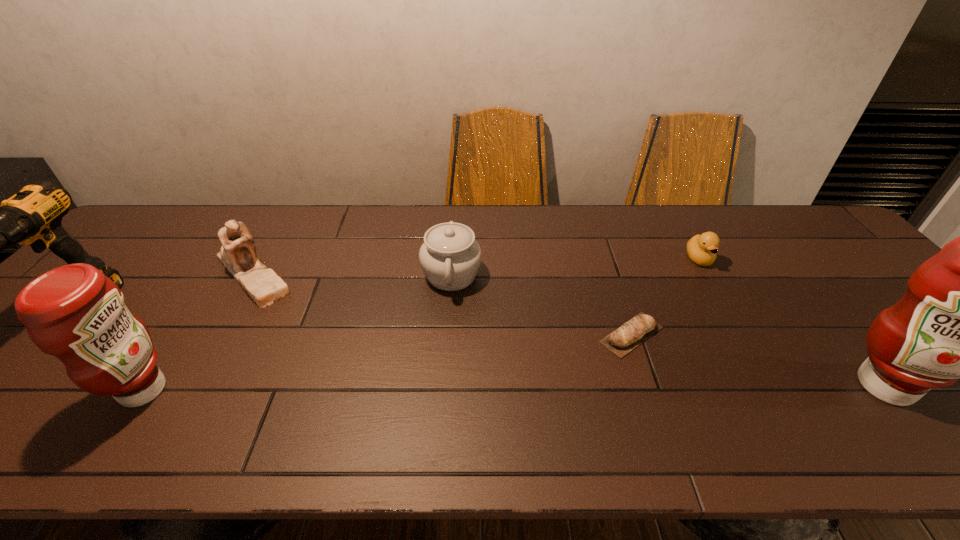
Identify the location of the left condiment. (74, 312).

Locate an element on the screen. the taller condiment is located at coordinates (959, 318).

Where is `the rightmost object`? The width and height of the screenshot is (960, 540). the rightmost object is located at coordinates (959, 318).

The height and width of the screenshot is (540, 960). In order to click on the sixth tallest object in this screenshot , I will do `click(701, 249)`.

You are a GUI agent. You are given a task and a screenshot of the screen. Output one action in this format:
    pyautogui.click(x=<x>, y=<y>)
    Task: Click on the duckling
    Image resolution: width=960 pixels, height=540 pixels.
    Given the screenshot: What is the action you would take?
    pyautogui.click(x=701, y=249)

The width and height of the screenshot is (960, 540). I want to click on chinaware, so click(450, 257).

Where is `figurine`? The width and height of the screenshot is (960, 540). figurine is located at coordinates click(x=238, y=254).

Locate an element on the screen. This screenshot has width=960, height=540. the leftmost object is located at coordinates pyautogui.click(x=33, y=216).

Find the location of `the third object from right to left`. the third object from right to left is located at coordinates (634, 332).

Identify the location of pita bread. This screenshot has height=540, width=960. (634, 332).